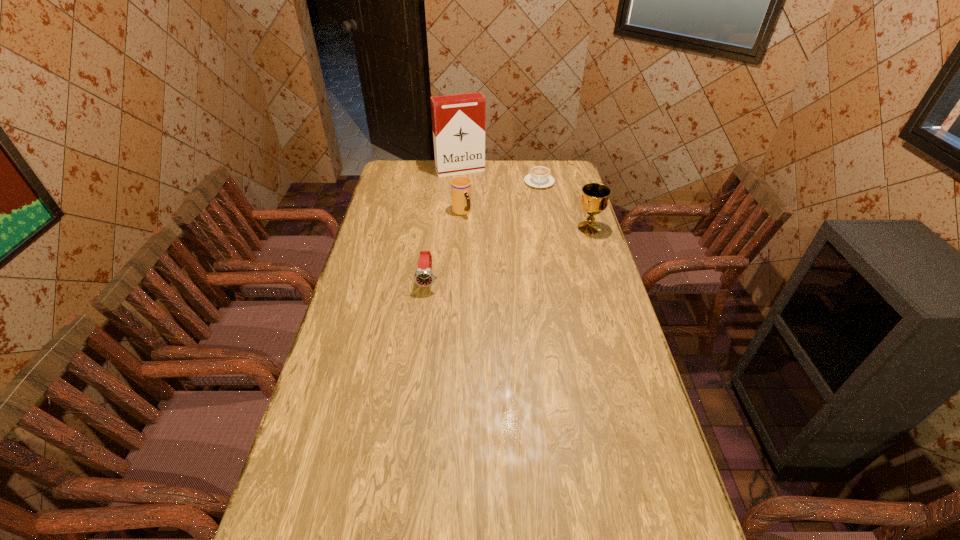
At what (x,y) coordinates should I click in order to perform the action: click on blank space that satisfies the following two spatial constraints: 1. on the front side of the second tallest object; 2. on the left side of the cappuccino. Please return your answer as a coordinate pair (x, y). The width and height of the screenshot is (960, 540). Looking at the image, I should click on (548, 228).